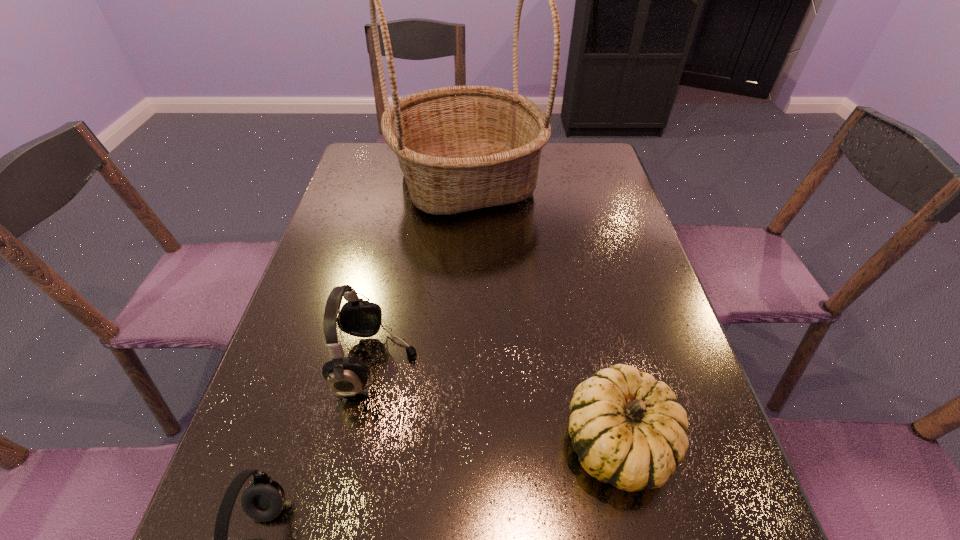
You are a GUI agent. You are given a task and a screenshot of the screen. Output one action in this format:
    pyautogui.click(x=<x>, y=<y>)
    Task: Click on the free space between the tallest object and the second tallest object
    The image size is (960, 540).
    Given the screenshot: What is the action you would take?
    pyautogui.click(x=421, y=272)

At what (x,y) coordinates should I click in order to perform the action: click on free space between the tallest object and the gourd. Please return your answer as a coordinate pair (x, y). The height and width of the screenshot is (540, 960). Looking at the image, I should click on (542, 312).

Image resolution: width=960 pixels, height=540 pixels. I want to click on free space that is in between the gourd and the right headset, so click(x=497, y=403).

Identify which object is located as the third nearest to the gourd. Please provide its 2D coordinates. Your answer should be formatted as a tuple, i.e. [(x, y)], where the tuple contains the x and y coordinates of a point satisfying the conditions above.

[(460, 148)]

This screenshot has height=540, width=960. In order to click on object that stands as the second closest to the gourd in this screenshot , I will do `click(262, 501)`.

You are a GUI agent. You are given a task and a screenshot of the screen. Output one action in this format:
    pyautogui.click(x=<x>, y=<y>)
    Task: Click on the blank area in the image that satisfies the following two spatial constraints: 1. on the front side of the gourd; 2. on the left side of the basket
    This screenshot has height=540, width=960.
    Given the screenshot: What is the action you would take?
    pyautogui.click(x=456, y=442)

This screenshot has height=540, width=960. I want to click on free space in the image that satisfies the following two spatial constraints: 1. on the back side of the gourd; 2. with the microphone on the side of the farther headset, so click(x=600, y=363).

The image size is (960, 540). Identify the location of free region that satisfies the following two spatial constraints: 1. on the front side of the gourd; 2. on the right side of the tallest object. (456, 442).

Identify the location of free space that satisfies the following two spatial constraints: 1. with the microphone on the side of the second tallest object; 2. on the left side of the gourd. (362, 442).

Locate an element on the screen. The height and width of the screenshot is (540, 960). vacant area in the image that satisfies the following two spatial constraints: 1. with the microphone on the side of the gourd; 2. on the right side of the taller headset is located at coordinates (362, 442).